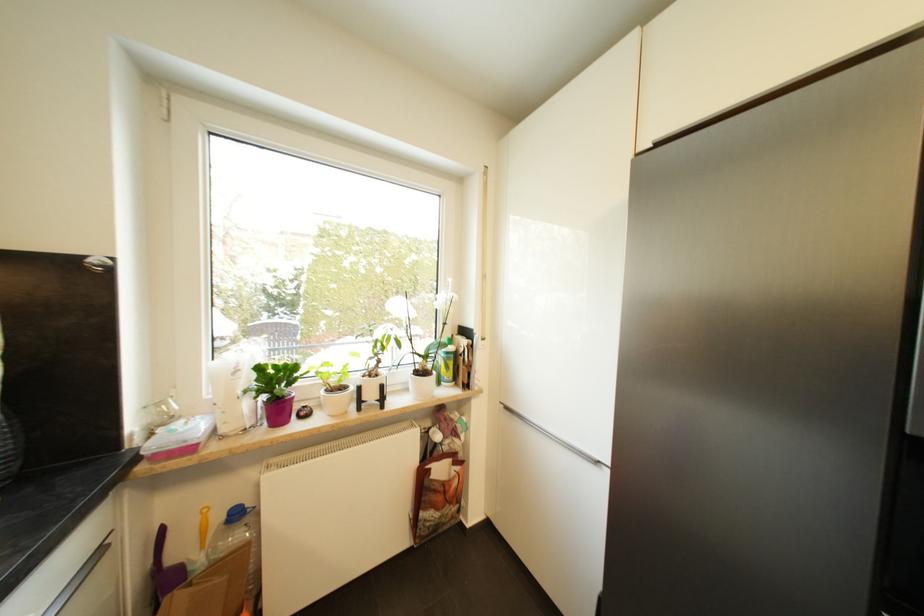
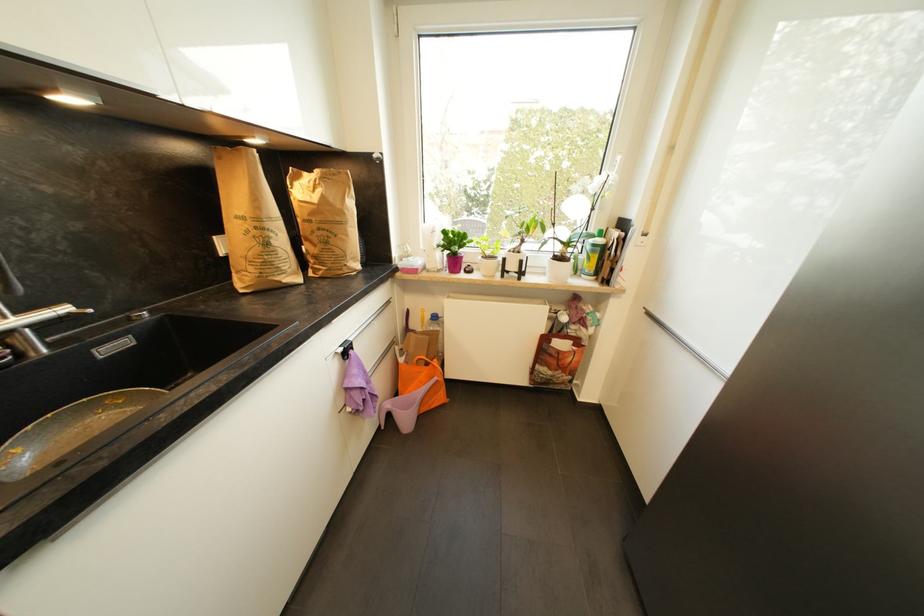
Where in the second image is the point corresponding to [327,394] from the first image?

(484, 259)